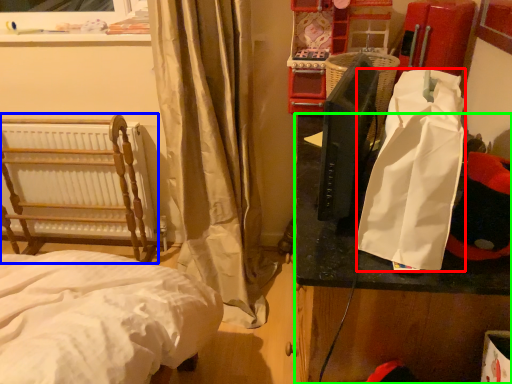
Question: Which object is the farthest from shopping bag (highlighted by a red box)? Choose among these: furniture (highlighted by a blue box) or table (highlighted by a green box).

Choices:
 (A) furniture
 (B) table

Answer: (A)